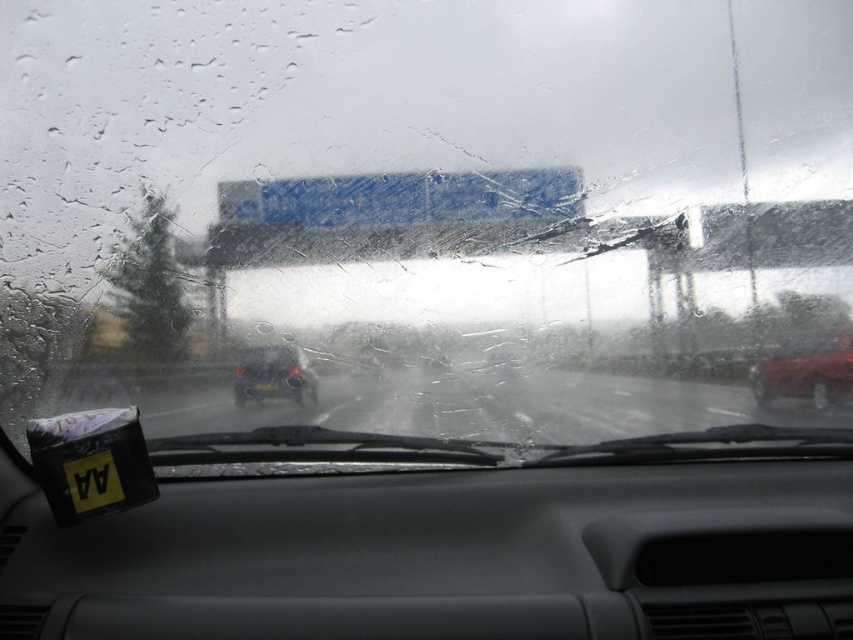
You are a driver trying to navigate in the rain. You see the shiny red sedan at right and the black matte license plate at lower left. Which object is closer to the windshield?

The shiny red sedan at right is above the black matte license plate at lower left, so the shiny red sedan at right is closer to the windshield.

You are a driver inside the car and need to reach the destination safely. Considering the visibility through the transparent wet glass at center, which is 3.43 meters away from you, can you estimate how far you can see clearly through the windshield?

The transparent wet glass at center is 3.43 meters away from the viewer, so you can see clearly up to 3.43 meters through the windshield.